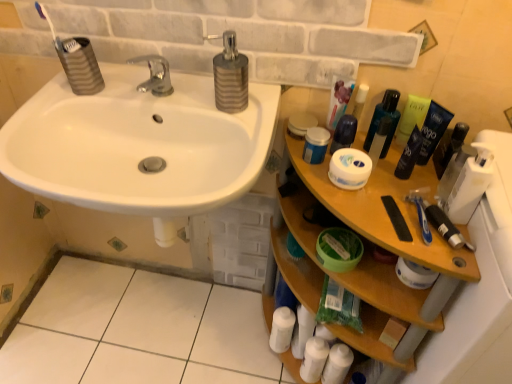
Question: Is transparent plastic bottle at upper right, the 5th mouthwash when ordered from right to left, situated inside white tile at lower left or outside?

Choices:
 (A) outside
 (B) inside

Answer: (A)

Question: Does point (378, 122) appear closer or farther from the camera than point (82, 261)?

Choices:
 (A) farther
 (B) closer

Answer: (B)

Question: Estimate the real-world distances between objects in this image. Which object is farther from the silver metallic soap dispenser at upper center?

Choices:
 (A) blue plastic toothbrush at right, positioned as the first toothbrush in front-to-back order
 (B) white tile at lower left
 (C) white glossy sink at upper left
 (D) white matte jar at center
 (E) transparent plastic bottle at upper right, which is the third mouthwash from left to right

Answer: (B)

Question: Which of these objects is positioned farthest from the white matte tube at upper right?

Choices:
 (A) white matte jar at center
 (B) white matte bottle at lower center, which is counted as the second toiletry, starting from the bottom
 (C) dark blue plastic mouthwash at upper right, acting as the fourth mouthwash starting from the left
 (D) transparent plastic bottle at upper right, which is the third mouthwash from left to right
 (E) white glossy sink at upper left

Answer: (B)